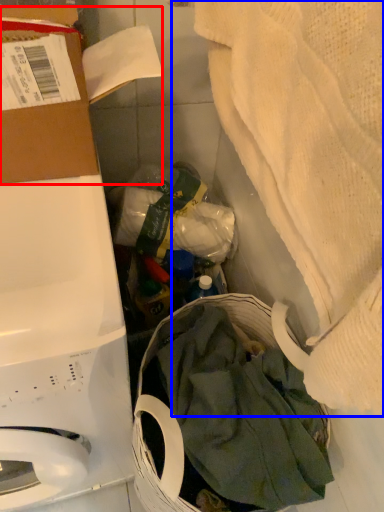
Question: Which point is closer to the camera, cardboard box (highlighted by a red box) or blanket (highlighted by a blue box)?

Choices:
 (A) cardboard box
 (B) blanket

Answer: (B)